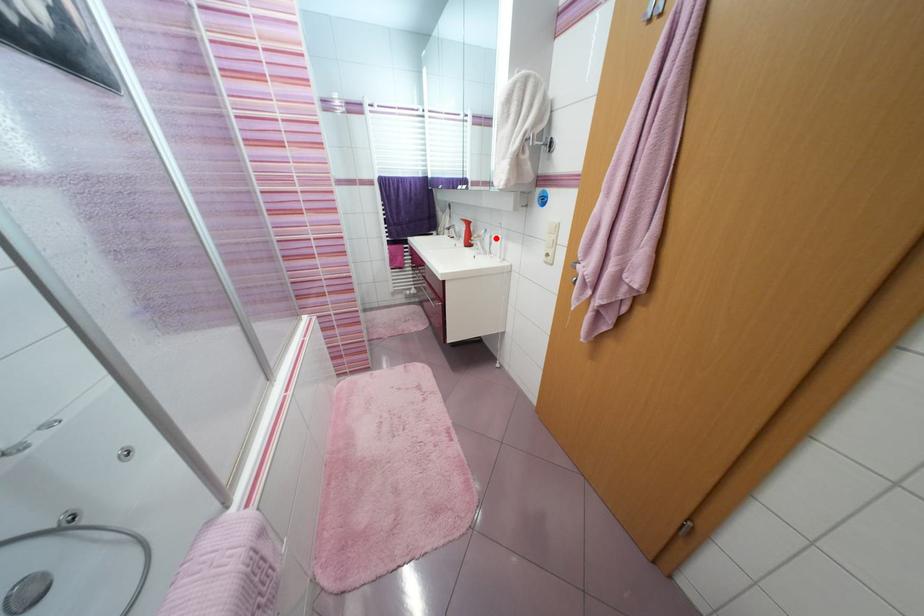
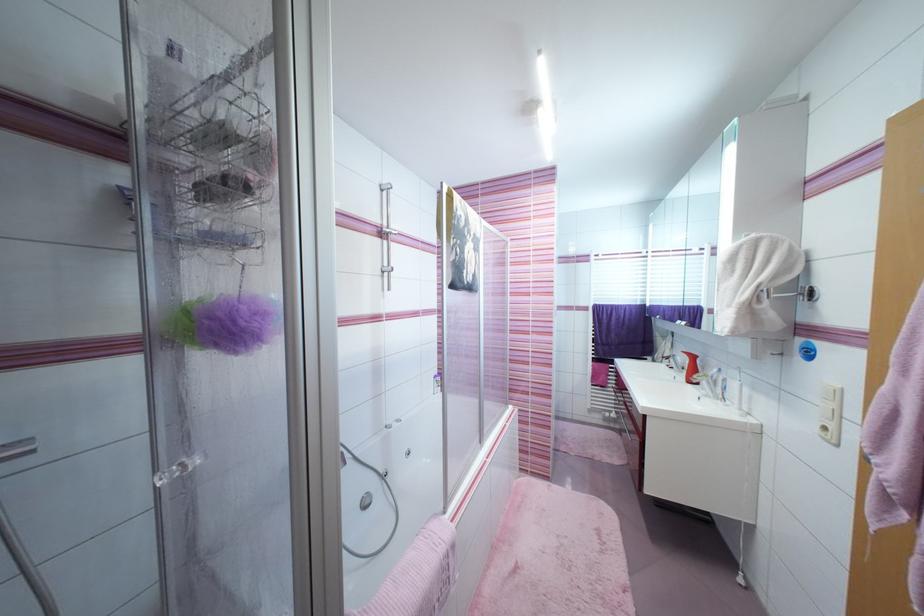
Where in the second image is the point corresponding to the highlighted location from the first image?

(730, 381)